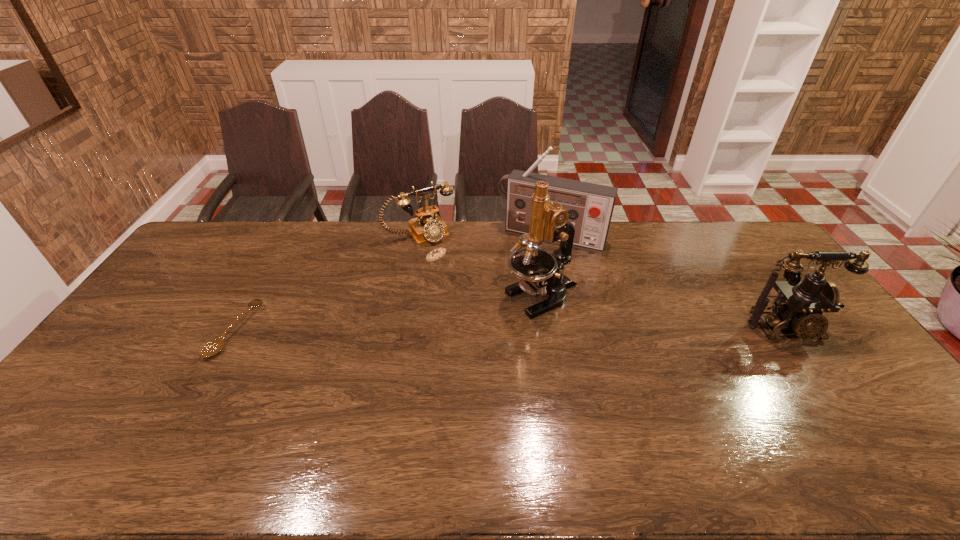
Where is `the shortest object`? the shortest object is located at coordinates (215, 346).

Find the location of a particular element. This screenshot has height=540, width=960. ladle is located at coordinates (215, 346).

At what (x,y) coordinates should I click in order to perform the action: click on the third shortest object. Please return your answer as a coordinate pair (x, y). Image resolution: width=960 pixels, height=540 pixels. Looking at the image, I should click on (800, 303).

The image size is (960, 540). In order to click on the nearer telephone in this screenshot , I will do `click(800, 303)`.

This screenshot has height=540, width=960. Find the location of `the second tallest object`. the second tallest object is located at coordinates (590, 206).

Find the location of a particular element. Image resolution: width=960 pixels, height=540 pixels. the farther telephone is located at coordinates (428, 227).

I want to click on the fourth tallest object, so click(x=428, y=227).

At what (x,y) coordinates should I click in order to perform the action: click on microscope. Please return your answer as a coordinate pair (x, y). Image resolution: width=960 pixels, height=540 pixels. Looking at the image, I should click on (541, 272).

The height and width of the screenshot is (540, 960). In order to click on vacant space located on the back of the shortest object in this screenshot , I will do `click(277, 255)`.

Locate an element on the screen. The image size is (960, 540). free point located 0.170m on the rotary dial of the taller telephone is located at coordinates (835, 401).